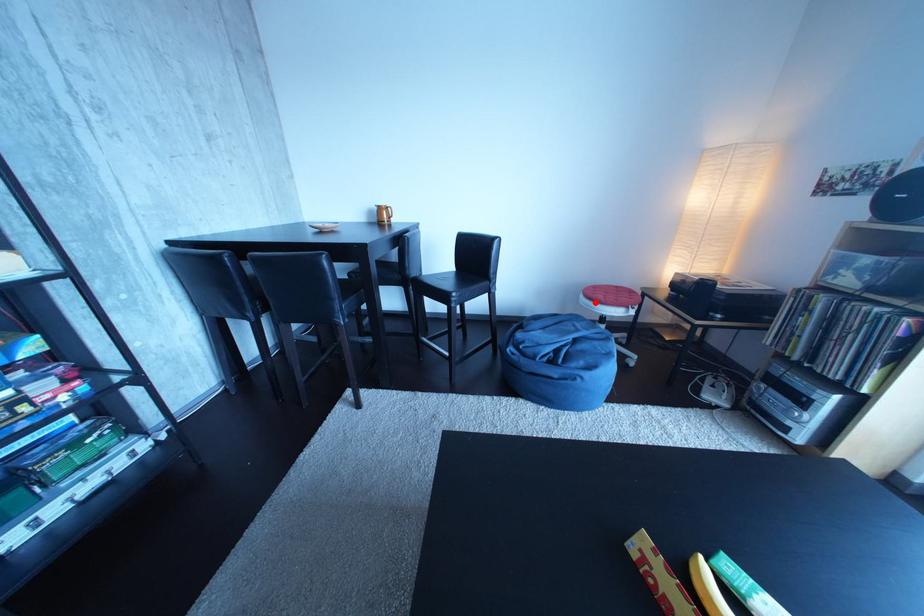
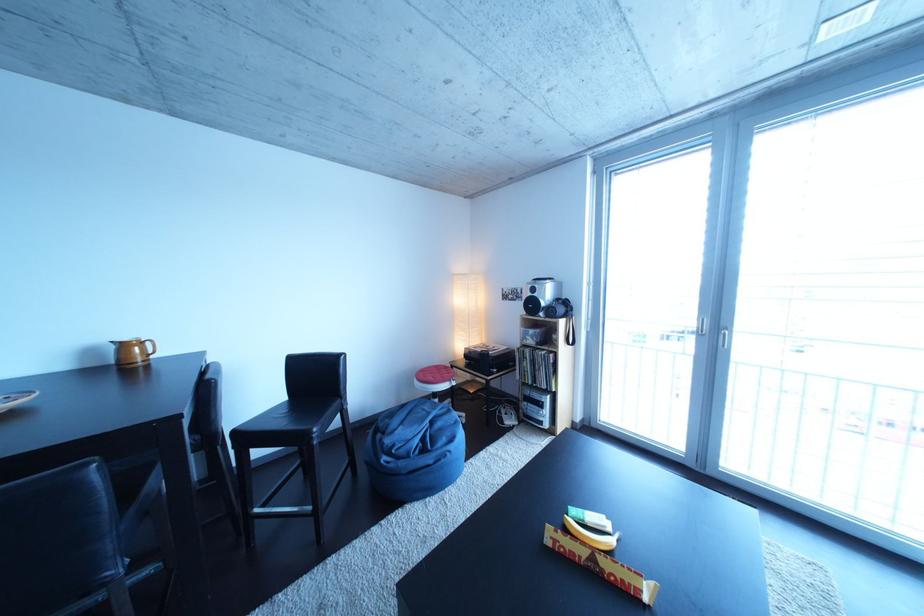
Where in the second image is the point corresponding to the highlighted location from the first image?

(430, 387)